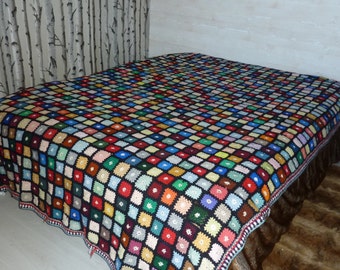
I want to click on right corner of bed, so click(x=211, y=218).